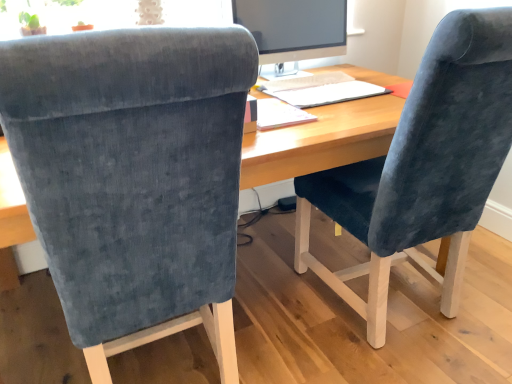
This screenshot has width=512, height=384. Identify the location of vacant area on top of white paper notepad at center (from a real-world perspective). (277, 105).